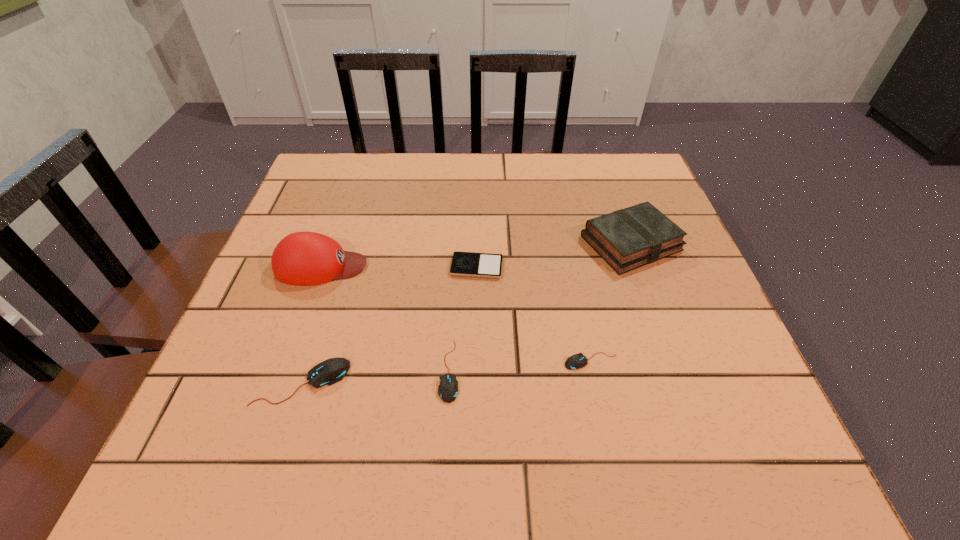
You are a GUI agent. You are given a task and a screenshot of the screen. Output one action in this format:
    pyautogui.click(x=<x>, y=<y>)
    Task: Click on the free space for a new mouse on the right
    The width and height of the screenshot is (960, 540).
    Given the screenshot: What is the action you would take?
    pyautogui.click(x=728, y=352)